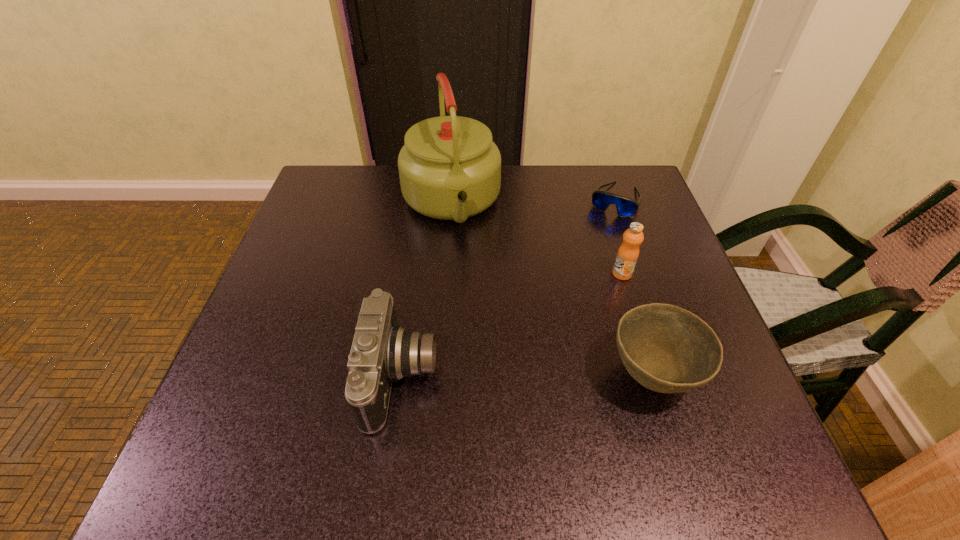
This screenshot has width=960, height=540. In order to click on free space located on the front label of the orange juice in this screenshot , I will do `click(527, 368)`.

Identify the location of free region located on the front label of the orange juice. (586, 310).

Identify the location of blank area located 0.130m on the front label of the orange juice. (583, 313).

You are a GUI agent. You are given a task and a screenshot of the screen. Output one action in this format:
    pyautogui.click(x=<x>, y=<y>)
    Task: Click on the free space located 0.200m at the spout of the kettle
    The height and width of the screenshot is (540, 960).
    Given the screenshot: What is the action you would take?
    pyautogui.click(x=474, y=310)

Locate an element on the screen. The image size is (960, 540). free space located 0.080m at the spout of the kettle is located at coordinates (465, 269).

Locate an element on the screen. blank space located at the spout of the kettle is located at coordinates (470, 293).

Image resolution: width=960 pixels, height=540 pixels. I want to click on sunglasses that is at the far edge, so click(626, 207).

Where is `kettle present at the far edge`? kettle present at the far edge is located at coordinates (449, 168).

You are a GUI agent. You are given a task and a screenshot of the screen. Output one action in this format:
    pyautogui.click(x=<x>, y=<y>)
    Task: Click on the camera located at the near edge
    This screenshot has width=960, height=540.
    Given the screenshot: What is the action you would take?
    pyautogui.click(x=382, y=351)

Locate an element on the screen. The height and width of the screenshot is (540, 960). bowl at the near edge is located at coordinates (667, 349).